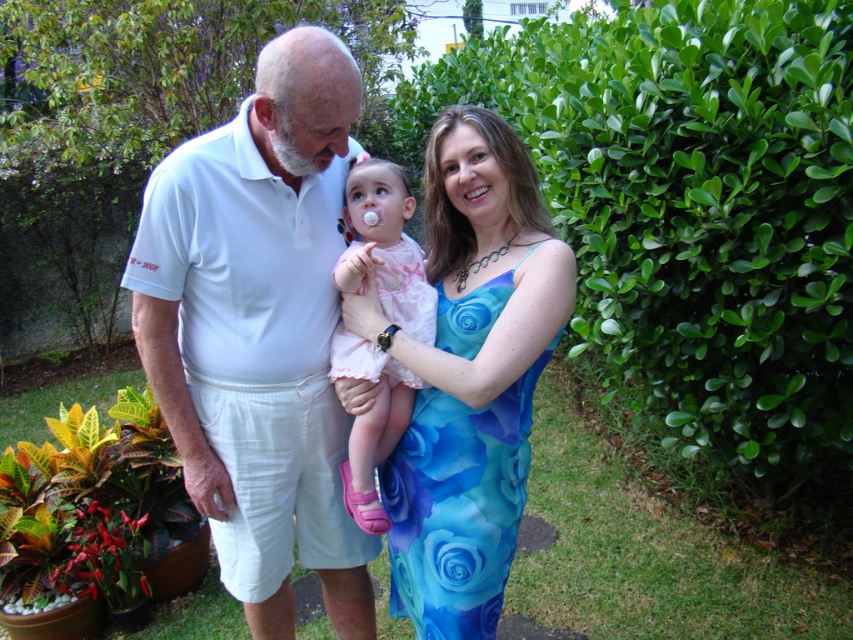
Between green leafy hedge at center right and blue floral fabric dress at center, which one has more height?

green leafy hedge at center right

Is green leafy hedge at center right bigger than blue floral fabric dress at center?

Yes.

Between point (622, 168) and point (427, 636), which one is positioned in front?

Positioned in front is point (427, 636).

In order to click on green leafy hedge at center right in this screenshot , I will do `click(691, 211)`.

Can you confirm if blue floral fabric dress at center is bigger than pink satin dress at center?

Indeed, blue floral fabric dress at center has a larger size compared to pink satin dress at center.

Does blue floral fabric dress at center appear under pink satin dress at center?

Indeed, blue floral fabric dress at center is positioned under pink satin dress at center.

Image resolution: width=853 pixels, height=640 pixels. What do you see at coordinates (457, 506) in the screenshot?
I see `blue floral fabric dress at center` at bounding box center [457, 506].

At what (x,y) coordinates should I click in order to perform the action: click on blue floral fabric dress at center. Please return your answer as a coordinate pair (x, y). This screenshot has width=853, height=640. Looking at the image, I should click on (457, 506).

Is green leafy hedge at center right shorter than pink satin dress at center?

No.

Between green leafy hedge at center right and pink satin dress at center, which one appears on the right side from the viewer's perspective?

green leafy hedge at center right is more to the right.

Who is more forward, [552,209] or [387,401]?

Point [387,401]

Locate an element on the screen. Image resolution: width=853 pixels, height=640 pixels. green leafy hedge at center right is located at coordinates (691, 211).